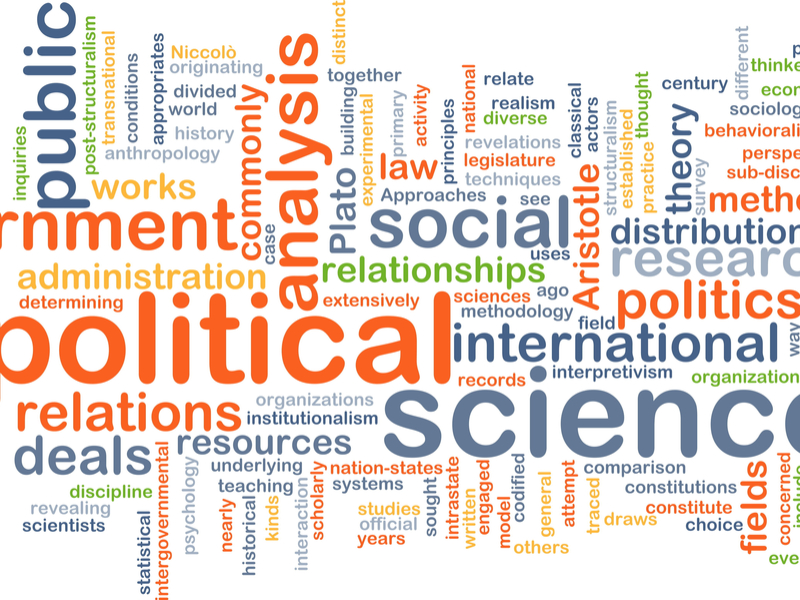
Find the location of a particular element. The height and width of the screenshot is (600, 800). inspirational word collage is located at coordinates (50, 47).